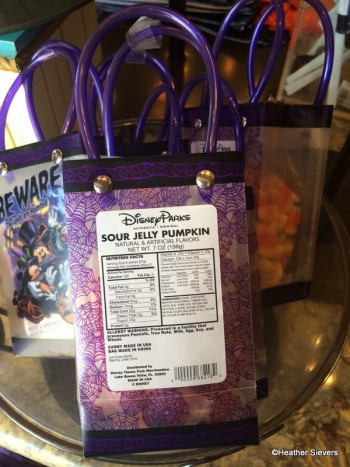
The width and height of the screenshot is (350, 467). Identify the location of handle. (62, 54), (67, 46), (104, 62), (122, 52), (155, 95), (188, 86), (175, 16), (223, 25), (253, 35).